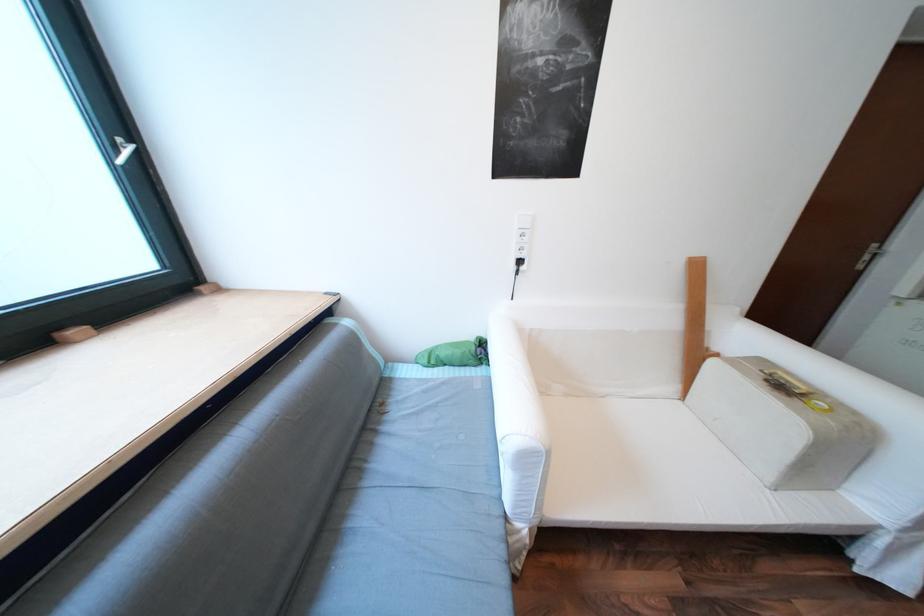
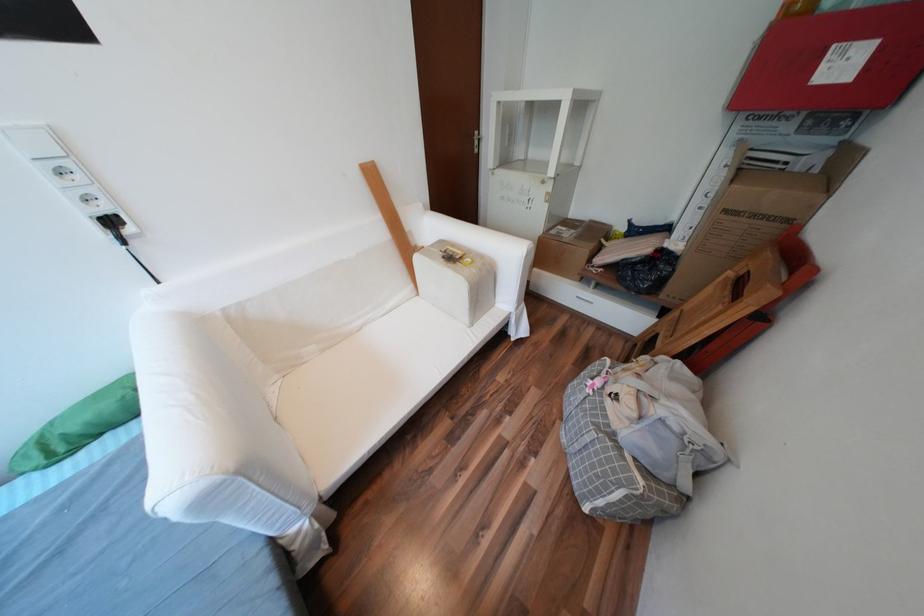
Where in the second image is the point corresponding to (x=523, y=262) from the first image?

(103, 225)